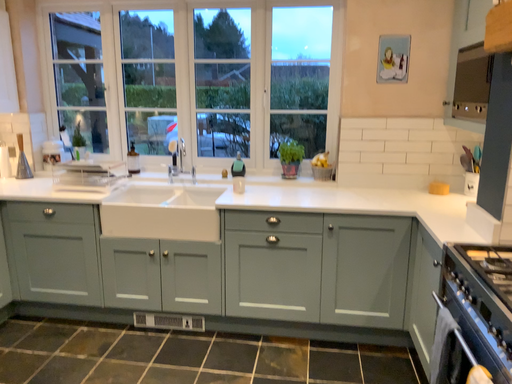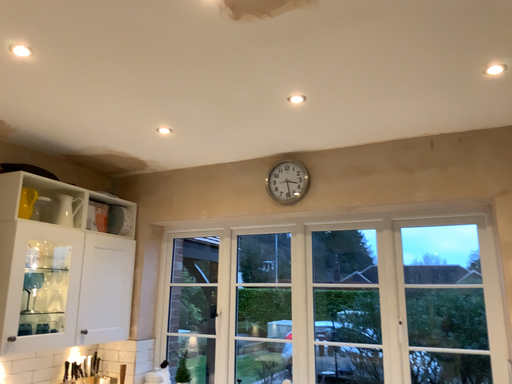
Question: Which way did the camera rotate in the video?

Choices:
 (A) rotated upward
 (B) rotated downward

Answer: (A)